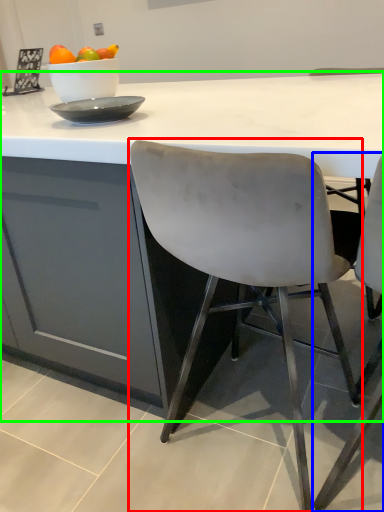
Question: Estimate the real-world distances between objects in this image. Which object is closer to chair (highlighted by a red box), chair (highlighted by a blue box) or table (highlighted by a green box)?

Choices:
 (A) chair
 (B) table

Answer: (B)